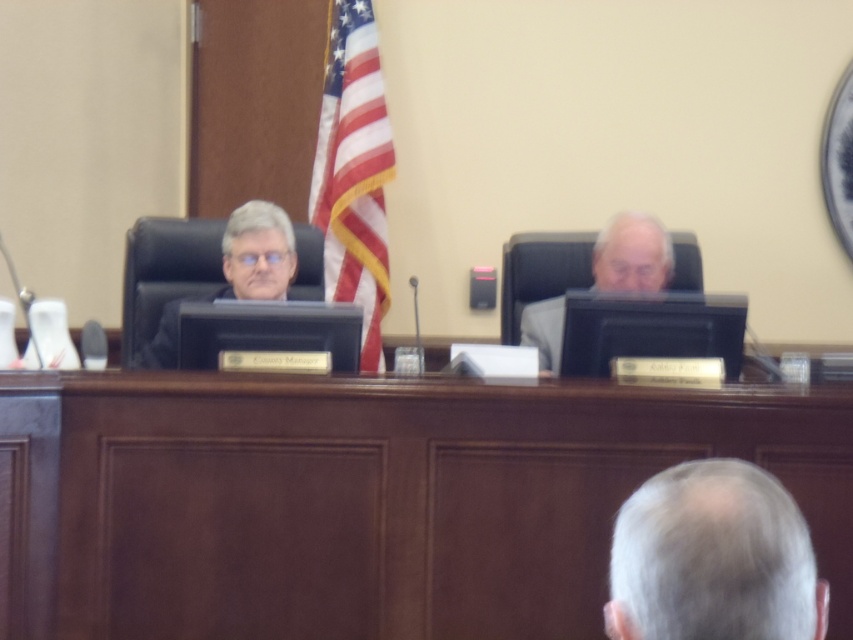
You are standing at the entrance of the room and need to locate the brown wood table at center. According to the coordinates provided, where should you look to find it?

The brown wood table at center is located at coordinates point (366, 499), so you should look towards the lower right area of the room to find it.

You are a photographer standing at the entrance of the room. You need to take a photo of the gray hair at lower right. Where should you position yourself to capture it in the frame?

The gray hair at lower right is located at point 0.873 on the x axis and 0.837 on the y axis, so you should position yourself to the lower right of the frame to capture it.

You are a photographer trying to capture a photo of the brown wood table at center and the american flag at center in the scene. The minimum distance required between the two objects for your camera to focus properly is 5 feet. Can you take the photo with both objects in focus?

The brown wood table at center and american flag at center are 5.37 feet apart from each other, which exceeds the 5 feet minimum distance required for the camera to focus properly. Therefore, you can take the photo with both objects in focus.